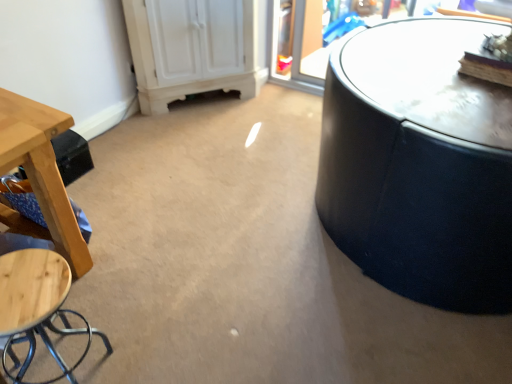
This screenshot has height=384, width=512. Describe the element at coordinates (37, 305) in the screenshot. I see `wooden stool at lower left` at that location.

Find the location of `wooden stool at lower left`. wooden stool at lower left is located at coordinates (37, 305).

Measure the distance between point [81,241] and camera.

A distance of 5.94 feet exists between point [81,241] and camera.

Locate an element on the screen. The height and width of the screenshot is (384, 512). wooden stool at left is located at coordinates (40, 174).

What do you see at coordinates (40, 174) in the screenshot? The width and height of the screenshot is (512, 384). I see `wooden stool at left` at bounding box center [40, 174].

Where is `wooden stool at lower left`? The width and height of the screenshot is (512, 384). wooden stool at lower left is located at coordinates (37, 305).

Visually, is wooden stool at lower left positioned to the left or to the right of wooden stool at left?

wooden stool at lower left is positioned on wooden stool at left's right side.

Who is more distant, wooden stool at lower left or wooden stool at left?

wooden stool at left.

Is point (9, 311) positioned after point (65, 233)?

No, (9, 311) is closer to viewer.

From the image's perspective, is wooden stool at lower left located above or below wooden stool at left?

Based on their image positions, wooden stool at lower left is located beneath wooden stool at left.

From a real-world perspective, is wooden stool at lower left positioned over wooden stool at left based on gravity?

No, from a real-world perspective, wooden stool at lower left is not above wooden stool at left.

Can you confirm if wooden stool at lower left is thinner than wooden stool at left?

Correct, the width of wooden stool at lower left is less than that of wooden stool at left.

Considering the relative sizes of wooden stool at lower left and wooden stool at left in the image provided, is wooden stool at lower left shorter than wooden stool at left?

No.

Can you confirm if wooden stool at lower left is smaller than wooden stool at left?

Correct, wooden stool at lower left occupies less space than wooden stool at left.

Is wooden stool at lower left situated inside wooden stool at left or outside?

wooden stool at lower left is located beyond the bounds of wooden stool at left.

Would you say wooden stool at lower left is a long distance from wooden stool at left?

They are positioned close to each other.

Is wooden stool at lower left aimed at wooden stool at left?

No, wooden stool at lower left is not oriented towards wooden stool at left.

This screenshot has width=512, height=384. I want to click on table located above the wooden stool at lower left (from a real-world perspective), so click(40, 174).

Which object is positioned more to the left, wooden stool at left or wooden stool at lower left?

From the viewer's perspective, wooden stool at left appears more on the left side.

Is wooden stool at left positioned before wooden stool at lower left?

No, it is behind wooden stool at lower left.

Is point (10, 105) closer to viewer compared to point (18, 268)?

No.

From the image's perspective, does wooden stool at left appear higher than wooden stool at lower left?

Correct, wooden stool at left appears higher than wooden stool at lower left in the image.

From a real-world perspective, does wooden stool at left sit lower than wooden stool at lower left?

No, from a real-world perspective, wooden stool at left is not below wooden stool at lower left.

Considering the sizes of wooden stool at left and wooden stool at lower left in the image, is wooden stool at left wider or thinner than wooden stool at lower left?

In the image, wooden stool at left appears to be wider than wooden stool at lower left.

Does wooden stool at left have a greater height compared to wooden stool at lower left?

No.

Between wooden stool at left and wooden stool at lower left, which one has smaller size?

Smaller between the two is wooden stool at lower left.

Is wooden stool at left inside the boundaries of wooden stool at lower left, or outside?

wooden stool at left cannot be found inside wooden stool at lower left.

Is wooden stool at left far away from wooden stool at lower left?

No, there isn't a large distance between wooden stool at left and wooden stool at lower left.

Is wooden stool at left positioned with its back to wooden stool at lower left?

wooden stool at left does not have its back to wooden stool at lower left.

Where is `table above the wooden stool at lower left (from the image's perspective)`? The height and width of the screenshot is (384, 512). table above the wooden stool at lower left (from the image's perspective) is located at coordinates (40, 174).

At what (x,y) coordinates should I click in order to perform the action: click on table behind the wooden stool at lower left. Please return your answer as a coordinate pair (x, y). The width and height of the screenshot is (512, 384). Looking at the image, I should click on (40, 174).

The width and height of the screenshot is (512, 384). In order to click on stool located underneath the wooden stool at left (from a real-world perspective) in this screenshot , I will do coord(37,305).